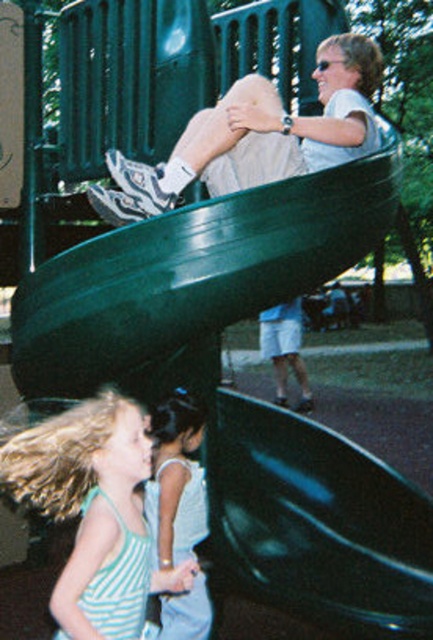
You are standing at the base of the green slide and want to reach the two points marked in the image. Which point, point (107, 413) or point (184, 538), is closer to you?

Point (107, 413) is closer to the viewer than point (184, 538).

You are a parent supervising children at the playground. You see the striped fabric dress at lower left and the matte white sneakers at upper center. Which child is closer to you?

The striped fabric dress at lower left is in front of matte white sneakers at upper center, so the child wearing the striped fabric dress at lower left is closer to you.